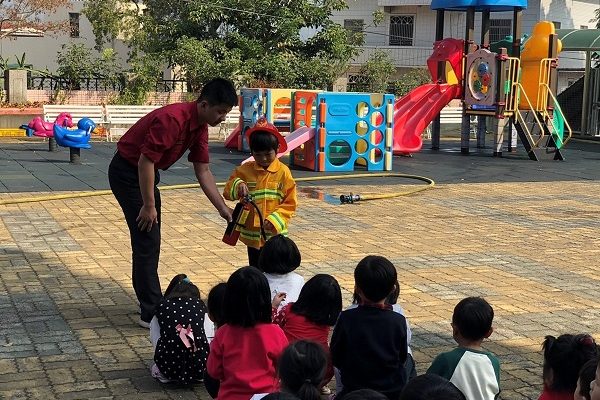
The image size is (600, 400). Identify the location of fire extinguisher. (247, 220).